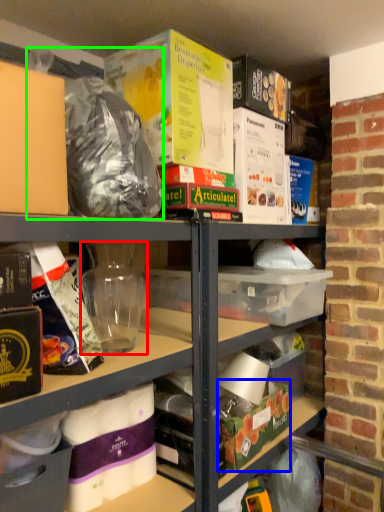
Question: Considering the real-world distances, which object is farthest from yoghurt (highlighted by a red box)? storage box (highlighted by a blue box) or garbage (highlighted by a green box)?

Choices:
 (A) storage box
 (B) garbage

Answer: (A)